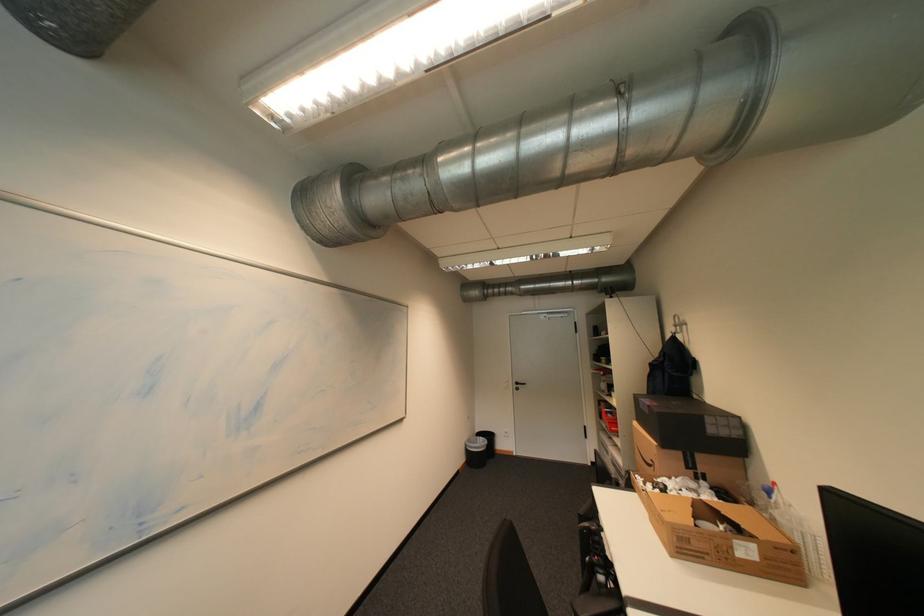
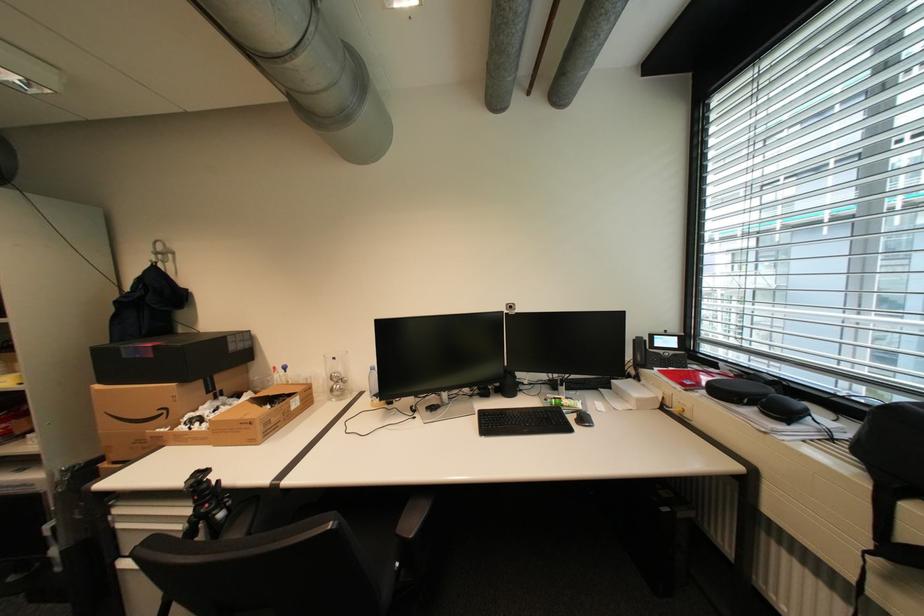
Locate, in the second image, the point that corresponds to point (604, 539) in the first image.

(213, 485)